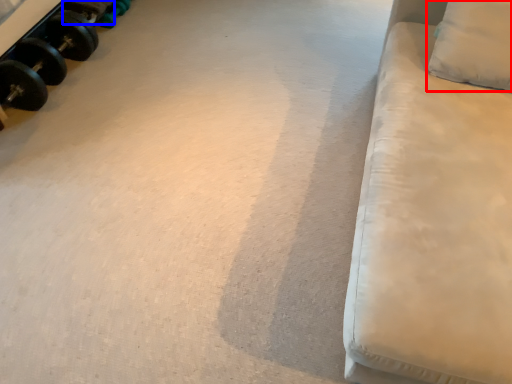
Question: Which of the following is the closest to the observer, pillow (highlighted by a red box) or dumbbell (highlighted by a blue box)?

Choices:
 (A) pillow
 (B) dumbbell

Answer: (A)